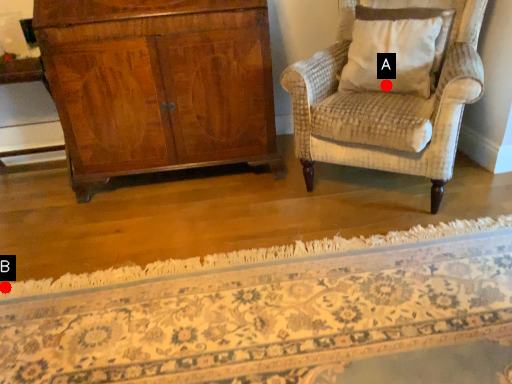
Question: Two points are circled on the image, labeled by A and B beside each circle. Which of the following is the closest to the observer?

Choices:
 (A) A is closer
 (B) B is closer

Answer: (B)